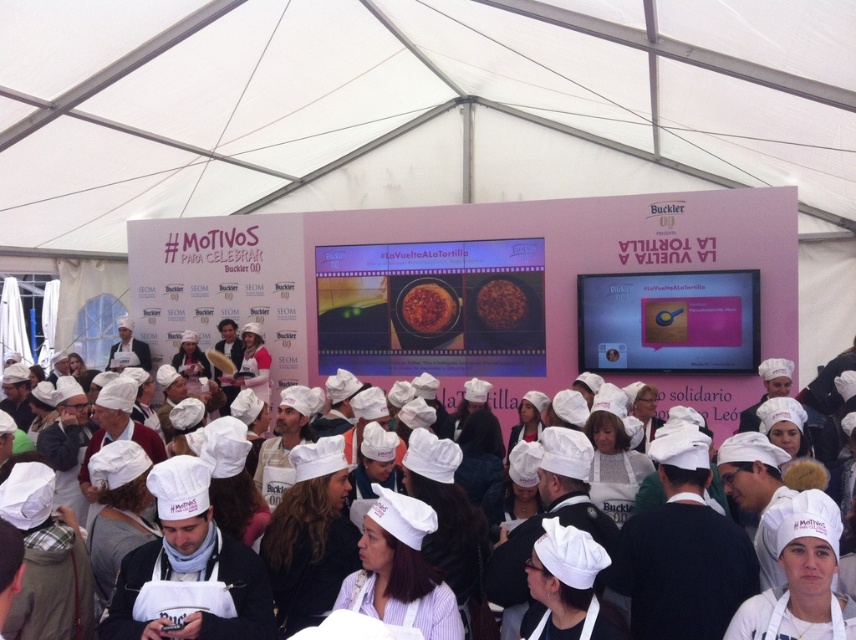
You are a guest at the event and want to take a photo under the white fabric canopy at upper center while also capturing the brown matte rice at center in the frame. Can you position yourself so that both objects are visible in the same photo?

The white fabric canopy at upper center is to the left of the brown matte rice at center, so you can position yourself between them or off to the side to include both in the photo.